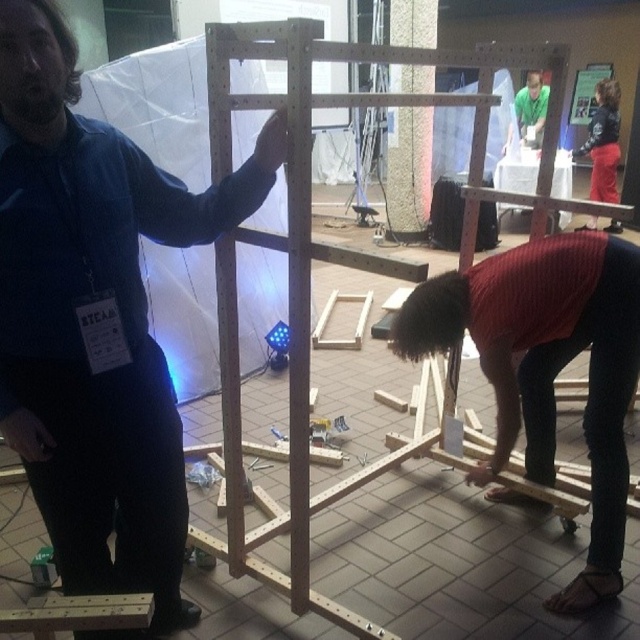
You are an observer in the workshop scene. You notice the knit red sweater at lower center and the red fabric skirt at lower right. Which object is shorter in height?

The knit red sweater at lower center is not as tall as the red fabric skirt at lower right, so the knit red sweater at lower center is shorter in height.

You are an observer in the workshop scene. You notice the blue fabric shirt at upper left and the natural wood easel at center. Which object is positioned more to the east side of the scene?

The blue fabric shirt at upper left is positioned to the left of the natural wood easel at center, so it is more to the east side of the scene.